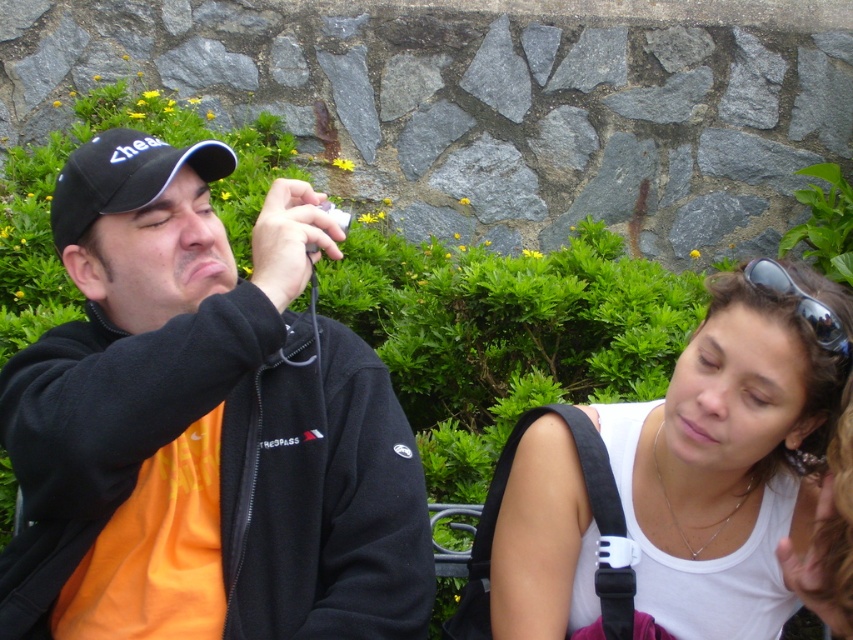
Question: Which point appears farthest from the camera in this image?

Choices:
 (A) (759, 262)
 (B) (712, 419)
 (C) (164, 573)
 (D) (160, 157)

Answer: (D)

Question: Can you confirm if black matte camera at center is positioned below black matte baseball cap at upper left?

Choices:
 (A) no
 (B) yes

Answer: (B)

Question: Estimate the real-world distances between objects in this image. Which object is closer to the white matte tank top at center?

Choices:
 (A) black matte camera at center
 (B) black matte baseball cap at upper left
 (C) sunglasses at upper right

Answer: (C)

Question: Where is black matte baseball cap at upper left located in relation to sunglasses at upper right in the image?

Choices:
 (A) right
 (B) left

Answer: (B)

Question: Which is nearer to the black matte camera at center?

Choices:
 (A) white matte tank top at center
 (B) black matte baseball cap at upper left
 (C) sunglasses at upper right

Answer: (B)

Question: Does white matte tank top at center appear on the left side of sunglasses at upper right?

Choices:
 (A) yes
 (B) no

Answer: (A)